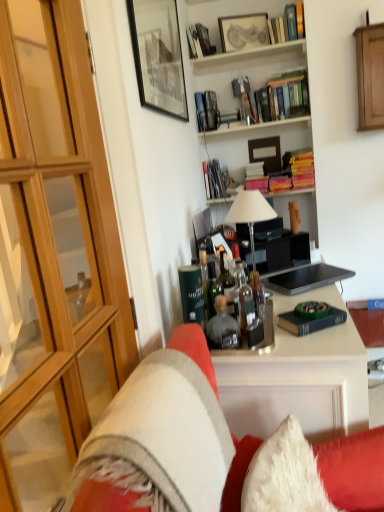
The height and width of the screenshot is (512, 384). What are the coordinates of `free spot above wooden bookshelf at upper center, the 1th shelf positioned from the top (from a real-world perspective)` in the screenshot? It's located at (242, 52).